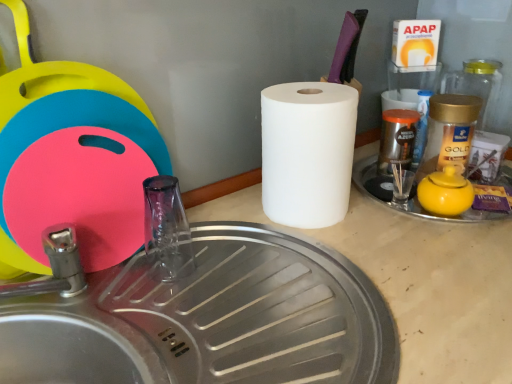
Locate an element on the screen. This screenshot has height=384, width=512. free region on the left part of yellow matte teapot at right is located at coordinates (387, 205).